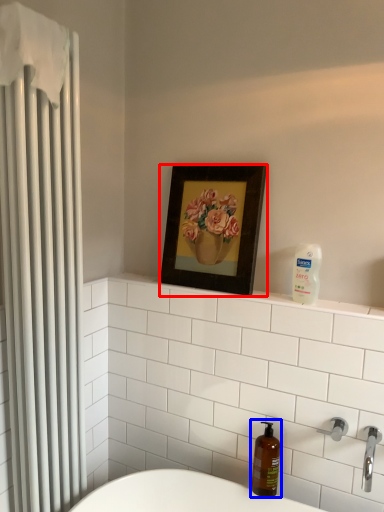
Question: Which of the following is the farthest to the observer, picture frame (highlighted by a red box) or soap dispenser (highlighted by a blue box)?

Choices:
 (A) picture frame
 (B) soap dispenser

Answer: (A)